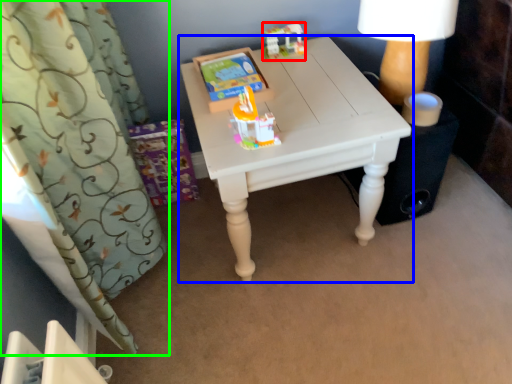
Question: Based on their relative distances, which object is farther from toy (highlighted by a red box)? Choose from table (highlighted by a blue box) and curtain (highlighted by a green box).

Choices:
 (A) table
 (B) curtain

Answer: (B)